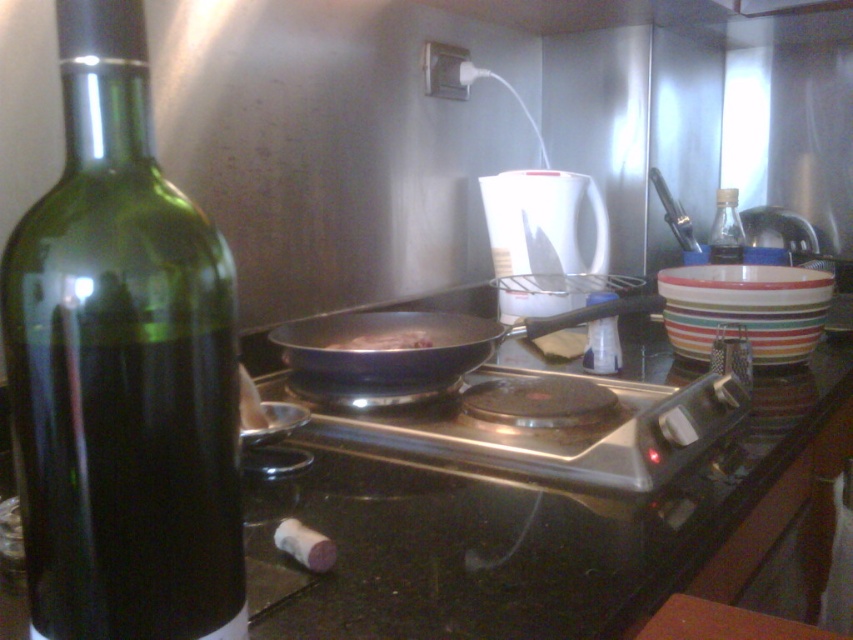
Between green glass bottle at left and shiny black frying pan at center, which one is positioned lower?

shiny black frying pan at center is below.

Can you confirm if green glass bottle at left is positioned to the right of shiny black frying pan at center?

No, green glass bottle at left is not to the right of shiny black frying pan at center.

Image resolution: width=853 pixels, height=640 pixels. I want to click on green glass bottle at left, so click(120, 369).

Is green glass bottle at left bigger than clear plastic bottle at center?

Yes.

Is green glass bottle at left in front of clear plastic bottle at center?

Yes, green glass bottle at left is closer to the viewer.

Which is in front, point (13, 436) or point (585, 307)?

Positioned in front is point (13, 436).

Find the location of a particular element. This screenshot has height=640, width=853. green glass bottle at left is located at coordinates (120, 369).

Describe the element at coordinates (554, 435) in the screenshot. This screenshot has height=640, width=853. I see `satin silver pan at center` at that location.

Does satin silver pan at center have a smaller size compared to brown matte pan at center?

Actually, satin silver pan at center might be larger than brown matte pan at center.

What do you see at coordinates (554, 435) in the screenshot? The image size is (853, 640). I see `satin silver pan at center` at bounding box center [554, 435].

Where is `satin silver pan at center`? The image size is (853, 640). satin silver pan at center is located at coordinates (554, 435).